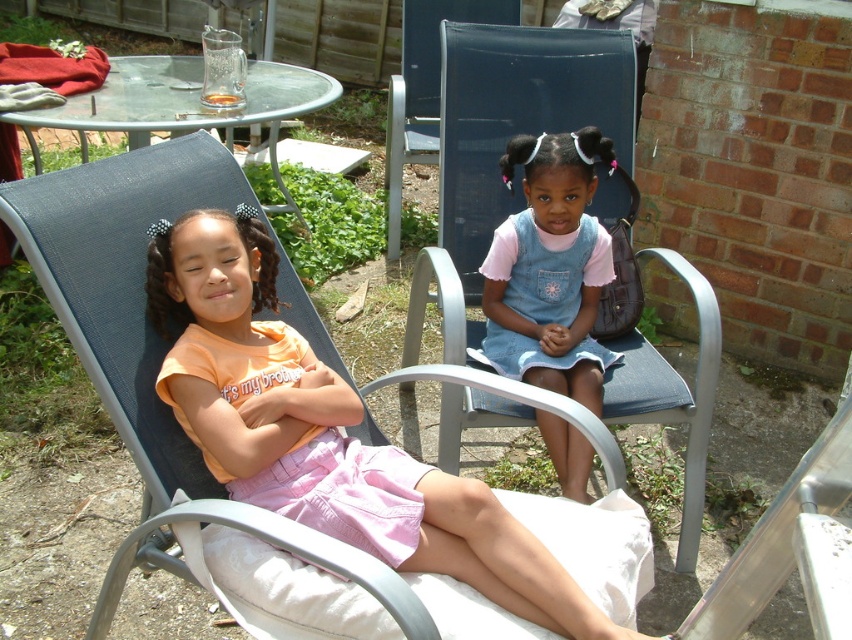
You are a photographer trying to capture the girl in the pink skirt. You want to ensure that your camera is focused on her while avoiding any distractions. Which object located at point (326, 433) should you be cautious of when framing your shot?

The pink cotton shorts at lower left located at point (326, 433) could be a distraction since they share a similar color with the girl in the pink skirt, so you should be cautious of the pink cotton shorts at lower left when framing your shot.

Looking at this image, you are a photographer trying to capture a photo of the two girls. You notice the pink cotton shorts at lower left and the denim dress at center. Which clothing item is more to the left side of the scene?

The pink cotton shorts at lower left is positioned on the left side of denim dress at center, so it is more to the left side of the scene.

You are a fashion designer observing two outfits in the image. The outfits belong to the two girls sitting on the lounge chairs. The first girl is wearing the pink cotton shorts at lower left, and the second girl is wearing the denim dress at center. Which outfit has a larger size?

The pink cotton shorts at lower left has a larger size compared to the denim dress at center.